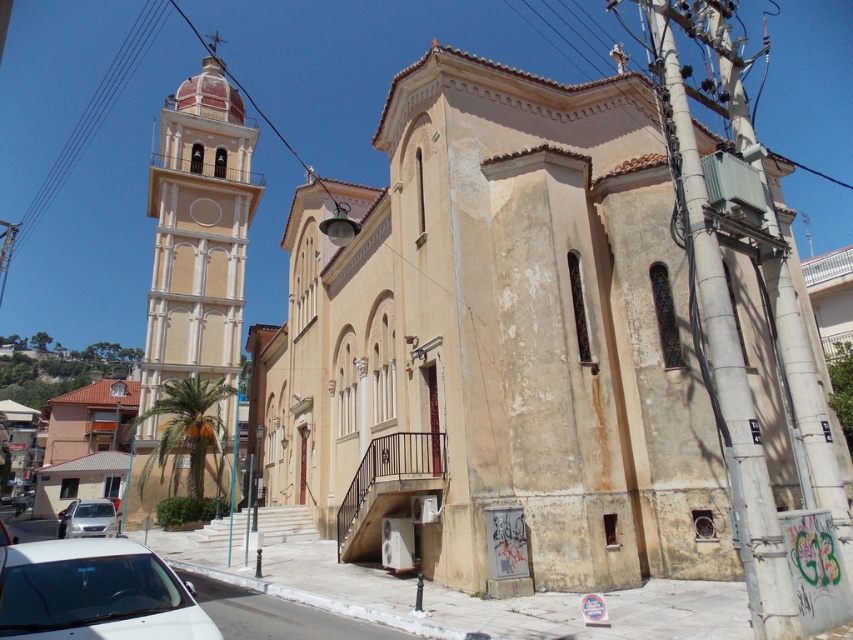
Question: Based on their relative distances, which object is nearer to the beige stucco bell tower at left?

Choices:
 (A) satin silver sedan at lower left
 (B) white matte car at lower left

Answer: (A)

Question: Is beige stucco bell tower at left behind white matte car at lower left?

Choices:
 (A) yes
 (B) no

Answer: (A)

Question: Is beige stucco church at center bigger than beige stucco bell tower at left?

Choices:
 (A) no
 (B) yes

Answer: (B)

Question: Is beige stucco church at center further to camera compared to white matte car at lower left?

Choices:
 (A) yes
 (B) no

Answer: (A)

Question: Which of the following is the closest to the observer?

Choices:
 (A) beige stucco bell tower at left
 (B) satin silver sedan at lower left

Answer: (B)

Question: Which of the following is the farthest from the observer?

Choices:
 (A) (161, 172)
 (B) (328, 208)
 (C) (189, 589)

Answer: (A)